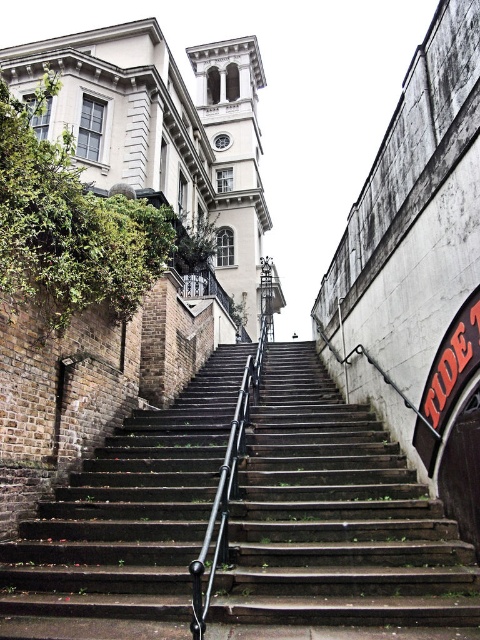
You are standing at point (335, 516) in the image. What object is directly in front of you?

The dark brown wooden stairs at center are directly in front of you at point (335, 516).

You are standing at the base of the stairs and want to take a photo of the dark brown wooden stairs at center. To ensure the stairs are in the center of your photo, where should you position yourself relative to the stairs?

Position yourself directly in front of the dark brown wooden stairs at center at point (335, 516) to center them in your photo.